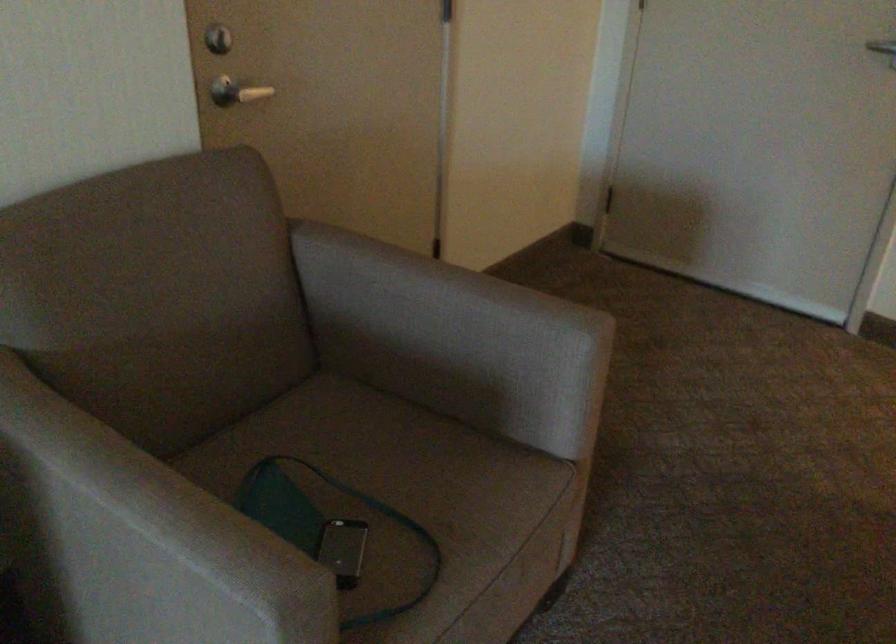
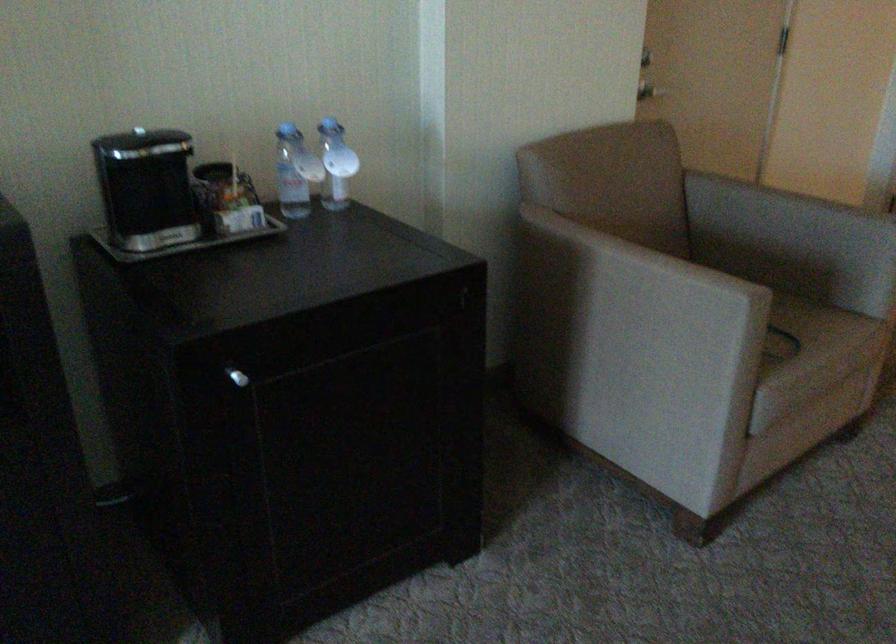
The point at (119, 543) is marked in the first image. Where is the corresponding point in the second image?

(631, 283)